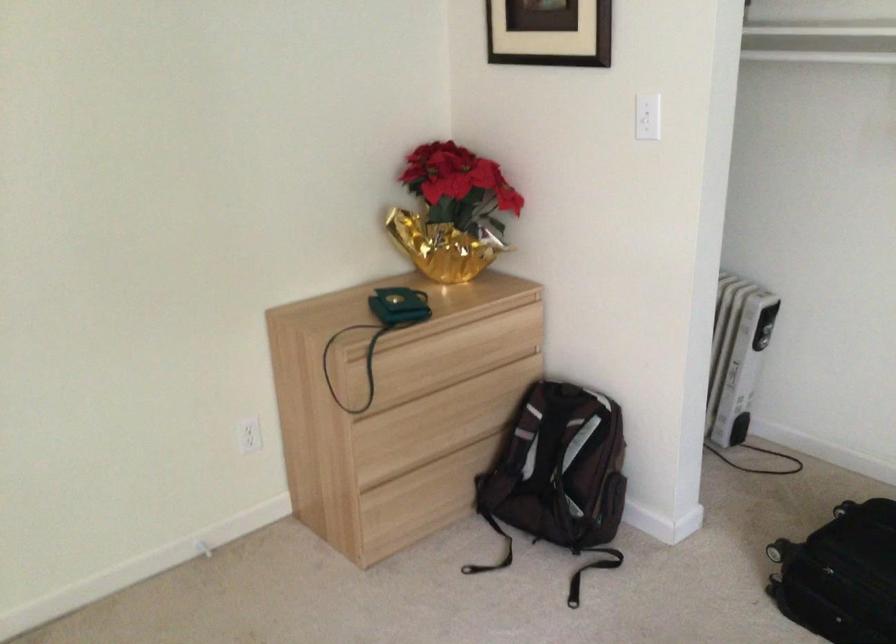
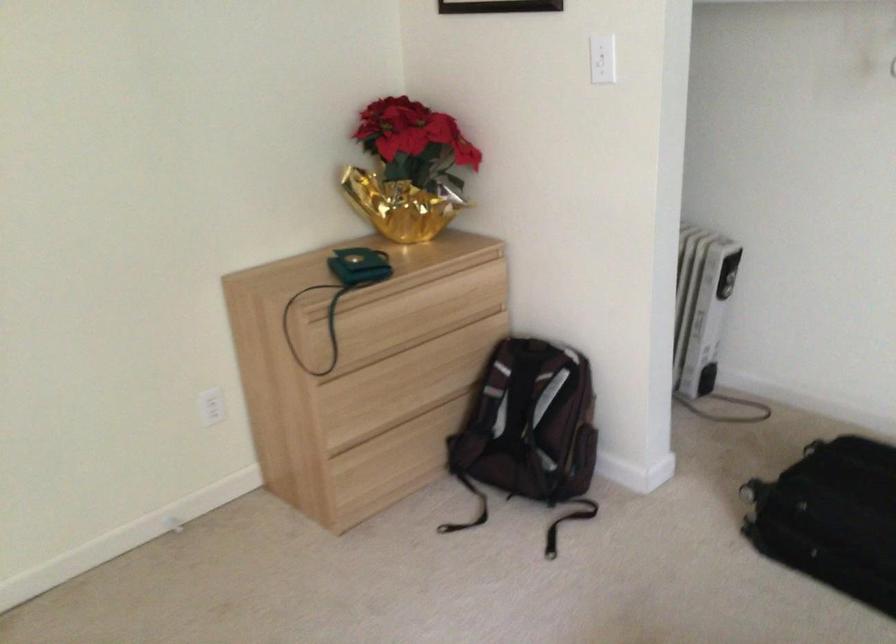
Find the pixel in the second image that matches [410,514] in the first image.

(382, 478)